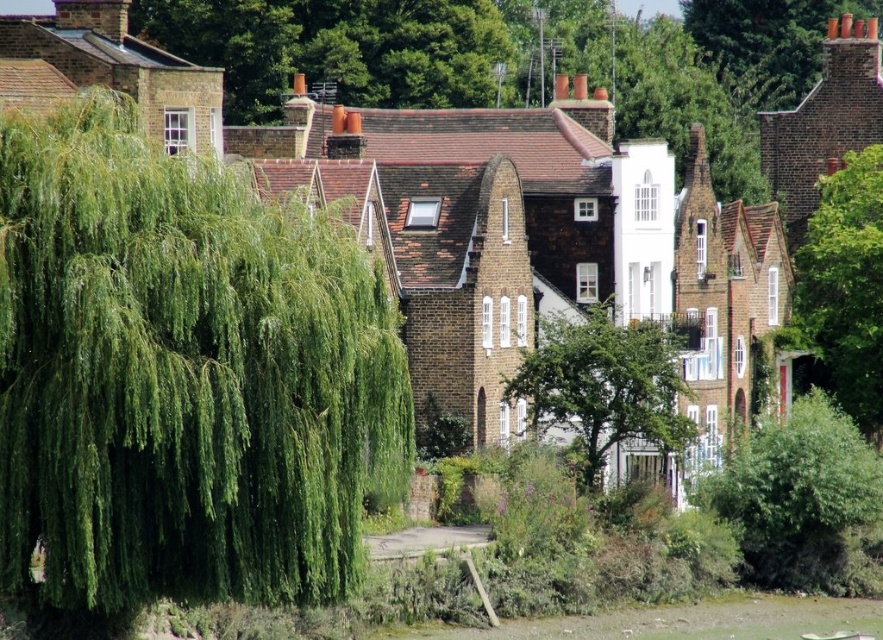
You are standing at the center of the image and want to walk towards the green leafy willow at left. Which direction should you move in?

The green leafy willow at left is located at point (183, 376), so you should move towards the left and slightly forward to reach it.